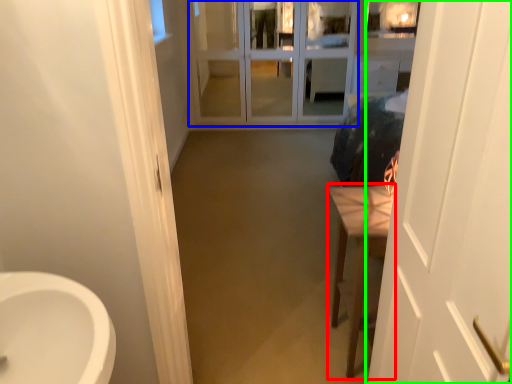
Question: Estimate the real-world distances between objects in this image. Which object is farther from furniture (highlighted by a red box), screen door (highlighted by a blue box) or door (highlighted by a green box)?

Choices:
 (A) screen door
 (B) door

Answer: (A)